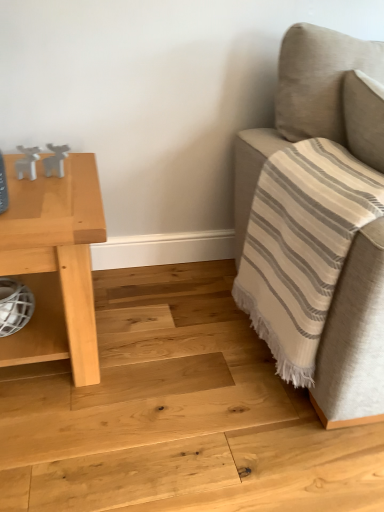
Image resolution: width=384 pixels, height=512 pixels. What do you see at coordinates (54, 263) in the screenshot?
I see `light wood table at left` at bounding box center [54, 263].

Locate an element on the screen. This screenshot has width=384, height=512. white mesh basket at lower left is located at coordinates (39, 325).

Measure the distance between white mesh basket at lower left and camera.

The depth of white mesh basket at lower left is 1.24 meters.

In order to face white matte deer at left, the second toy in the right-to-left sequence, should I rotate leftwards or rightwards?

To face it directly, rotate left by 20.782 degrees.

What do you see at coordinates (55, 160) in the screenshot?
I see `white matte deer at upper left, which appears as the 1th toy when viewed from the right` at bounding box center [55, 160].

Where is `light wood table at left`? light wood table at left is located at coordinates (54, 263).

Based on the photo, which of these two, white matte deer at left, the second toy in the right-to-left sequence, or white mesh basket at lower left, is smaller?

white matte deer at left, the second toy in the right-to-left sequence.

From the image's perspective, which is above, white matte deer at left, the second toy in the right-to-left sequence, or white mesh basket at lower left?

white matte deer at left, the second toy in the right-to-left sequence, from the image's perspective.

Is white matte deer at left, positioned as the first toy in left-to-right order, placed right next to white mesh basket at lower left?

No, white matte deer at left, positioned as the first toy in left-to-right order, is not touching white mesh basket at lower left.

From a real-world perspective, does white matte deer at left, the second toy in the right-to-left sequence, stand above white mesh basket at lower left?

Yes, from a real-world perspective, white matte deer at left, the second toy in the right-to-left sequence, is above white mesh basket at lower left.

In the image, is light wood table at left on the left side or the right side of white mesh basket at lower left?

light wood table at left is positioned on white mesh basket at lower left's right side.

Would you say light wood table at left is outside white mesh basket at lower left?

light wood table at left lies outside white mesh basket at lower left's area.

From a real-world perspective, between light wood table at left and white mesh basket at lower left, who is vertically higher?

light wood table at left, from a real-world perspective.

From the image's perspective, does light wood table at left appear lower than white mesh basket at lower left?

Incorrect, from the image's perspective, light wood table at left is higher than white mesh basket at lower left.

From a real-world perspective, relative to white mesh basket at lower left, is beige fabric couch at right vertically above or below?

Clearly, from a real-world perspective, beige fabric couch at right is above white mesh basket at lower left.

From the image's perspective, which object appears higher, beige fabric couch at right or white mesh basket at lower left?

beige fabric couch at right is shown above in the image.

Considering the relative sizes of beige fabric couch at right and white mesh basket at lower left in the image provided, is beige fabric couch at right bigger than white mesh basket at lower left?

Yes.

From a real-world perspective, between white matte deer at upper left, which appears as the 1th toy when viewed from the right, and light wood table at left, who is vertically higher?

white matte deer at upper left, which appears as the 1th toy when viewed from the right, from a real-world perspective.

Does white matte deer at upper left, which appears as the 1th toy when viewed from the right, have a greater height compared to light wood table at left?

In fact, white matte deer at upper left, which appears as the 1th toy when viewed from the right, may be shorter than light wood table at left.

Considering the sizes of white matte deer at upper left, the second toy positioned from the left, and light wood table at left in the image, is white matte deer at upper left, the second toy positioned from the left, wider or thinner than light wood table at left?

white matte deer at upper left, the second toy positioned from the left, is thinner than light wood table at left.

Is white matte deer at upper left, which appears as the 1th toy when viewed from the right, not within beige fabric couch at right?

That's correct, white matte deer at upper left, which appears as the 1th toy when viewed from the right, is outside of beige fabric couch at right.

Is white matte deer at upper left, the second toy positioned from the left, with beige fabric couch at right?

white matte deer at upper left, the second toy positioned from the left, is not next to beige fabric couch at right, and they're not touching.

Looking at the image, does white matte deer at upper left, the second toy positioned from the left, seem bigger or smaller compared to beige fabric couch at right?

In the image, white matte deer at upper left, the second toy positioned from the left, appears to be smaller than beige fabric couch at right.

Does white matte deer at upper left, the second toy positioned from the left, have a lesser height compared to beige fabric couch at right?

Correct, white matte deer at upper left, the second toy positioned from the left, is not as tall as beige fabric couch at right.

From the image's perspective, would you say white mesh basket at lower left is positioned over beige fabric couch at right?

No.

Can you confirm if white mesh basket at lower left is wider than beige fabric couch at right?

No, white mesh basket at lower left is not wider than beige fabric couch at right.

Is white mesh basket at lower left inside the boundaries of white matte deer at left, positioned as the first toy in left-to-right order, or outside?

white mesh basket at lower left exists outside the volume of white matte deer at left, positioned as the first toy in left-to-right order.

Is white mesh basket at lower left facing towards white matte deer at left, the second toy in the right-to-left sequence?

No, white mesh basket at lower left is not facing towards white matte deer at left, the second toy in the right-to-left sequence.

Which is in front, point (18, 277) or point (38, 152)?

Positioned in front is point (38, 152).

Are white mesh basket at lower left and white matte deer at left, positioned as the first toy in left-to-right order, far apart?

No, white mesh basket at lower left is not far away from white matte deer at left, positioned as the first toy in left-to-right order.

You are a GUI agent. You are given a task and a screenshot of the screen. Output one action in this format:
    pyautogui.click(x=<x>, y=<y>)
    Task: Click on the shelf that appears below the white matte deer at left, positioned as the first toy in left-to-right order (from the image's perspective)
    
    Given the screenshot: What is the action you would take?
    pyautogui.click(x=39, y=325)

At what (x,y) coordinates should I click in order to perform the action: click on table above the white mesh basket at lower left (from the image's perspective). Please return your answer as a coordinate pair (x, y). The width and height of the screenshot is (384, 512). Looking at the image, I should click on (54, 263).

When comparing their distances from beige fabric couch at right, does white matte deer at upper left, which appears as the 1th toy when viewed from the right, or white matte deer at left, the second toy in the right-to-left sequence, seem closer?

white matte deer at upper left, which appears as the 1th toy when viewed from the right, lies closer to beige fabric couch at right than the other object.

Considering their positions, is white mesh basket at lower left positioned further to light wood table at left than white matte deer at left, the second toy in the right-to-left sequence?

white matte deer at left, the second toy in the right-to-left sequence, lies further to light wood table at left than the other object.

Considering their positions, is white matte deer at left, positioned as the first toy in left-to-right order, positioned further to light wood table at left than white mesh basket at lower left?

The object further to light wood table at left is white matte deer at left, positioned as the first toy in left-to-right order.

Which object lies further to the anchor point white matte deer at left, the second toy in the right-to-left sequence, beige fabric couch at right or light wood table at left?

Based on the image, beige fabric couch at right appears to be further to white matte deer at left, the second toy in the right-to-left sequence.

Looking at the image, which one is located closer to white matte deer at left, positioned as the first toy in left-to-right order, beige fabric couch at right or white mesh basket at lower left?

Based on the image, white mesh basket at lower left appears to be nearer to white matte deer at left, positioned as the first toy in left-to-right order.

When comparing their distances from white matte deer at upper left, the second toy positioned from the left, does white mesh basket at lower left or white matte deer at left, the second toy in the right-to-left sequence, seem further?

Based on the image, white mesh basket at lower left appears to be further to white matte deer at upper left, the second toy positioned from the left.

Which object lies nearer to the anchor point beige fabric couch at right, white matte deer at upper left, which appears as the 1th toy when viewed from the right, or white mesh basket at lower left?

Based on the image, white matte deer at upper left, which appears as the 1th toy when viewed from the right, appears to be nearer to beige fabric couch at right.

From the picture: From the image, which object appears to be farther from light wood table at left, white mesh basket at lower left or white matte deer at upper left, the second toy positioned from the left?

white matte deer at upper left, the second toy positioned from the left, is further to light wood table at left.

At what (x,y) coordinates should I click in order to perform the action: click on toy between white matte deer at left, the second toy in the right-to-left sequence, and beige fabric couch at right. Please return your answer as a coordinate pair (x, y). This screenshot has height=512, width=384. Looking at the image, I should click on (55, 160).

I want to click on table that lies between white matte deer at upper left, the second toy positioned from the left, and white mesh basket at lower left from top to bottom, so click(54, 263).

You are a GUI agent. You are given a task and a screenshot of the screen. Output one action in this format:
    pyautogui.click(x=<x>, y=<y>)
    Task: Click on the toy between white matte deer at upper left, the second toy positioned from the left, and white mesh basket at lower left vertically
    
    Given the screenshot: What is the action you would take?
    tap(27, 162)

You are a GUI agent. You are given a task and a screenshot of the screen. Output one action in this format:
    pyautogui.click(x=<x>, y=<y>)
    Task: Click on the toy that lies between white matte deer at upper left, the second toy positioned from the left, and light wood table at left from top to bottom
    The image size is (384, 512).
    Given the screenshot: What is the action you would take?
    pyautogui.click(x=27, y=162)